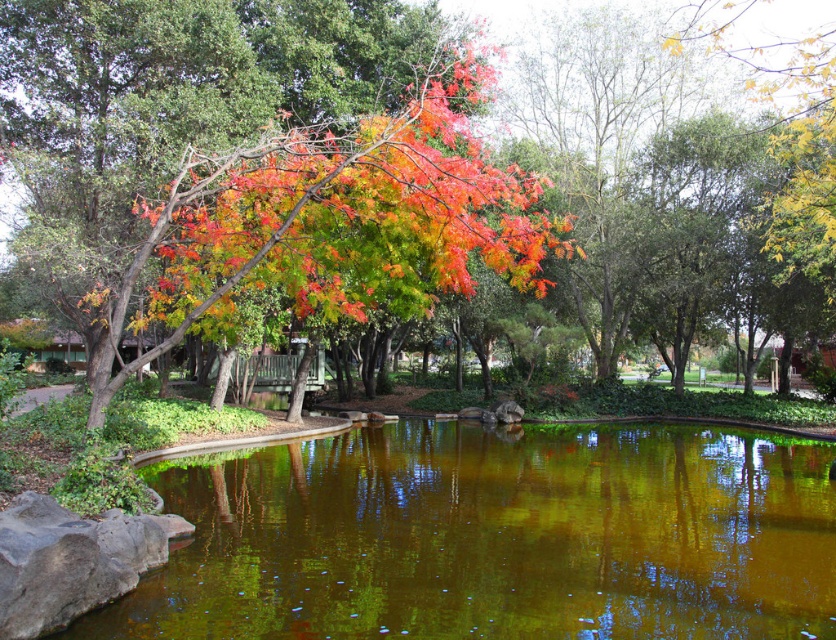
Question: Is green reflective water at center positioned before vivid orange leaves at center?

Choices:
 (A) yes
 (B) no

Answer: (A)

Question: Does green reflective water at center have a smaller size compared to vivid orange leaves at center?

Choices:
 (A) no
 (B) yes

Answer: (B)

Question: Is green reflective water at center to the left of vivid orange leaves at center from the viewer's perspective?

Choices:
 (A) no
 (B) yes

Answer: (A)

Question: Which point appears closest to the camera in this image?

Choices:
 (A) (217, 556)
 (B) (120, 372)

Answer: (A)

Question: Which of the following is the farthest from the observer?

Choices:
 (A) vivid orange leaves at center
 (B) green reflective water at center

Answer: (A)

Question: Which point is farther to the camera?

Choices:
 (A) green reflective water at center
 (B) vivid orange leaves at center

Answer: (B)